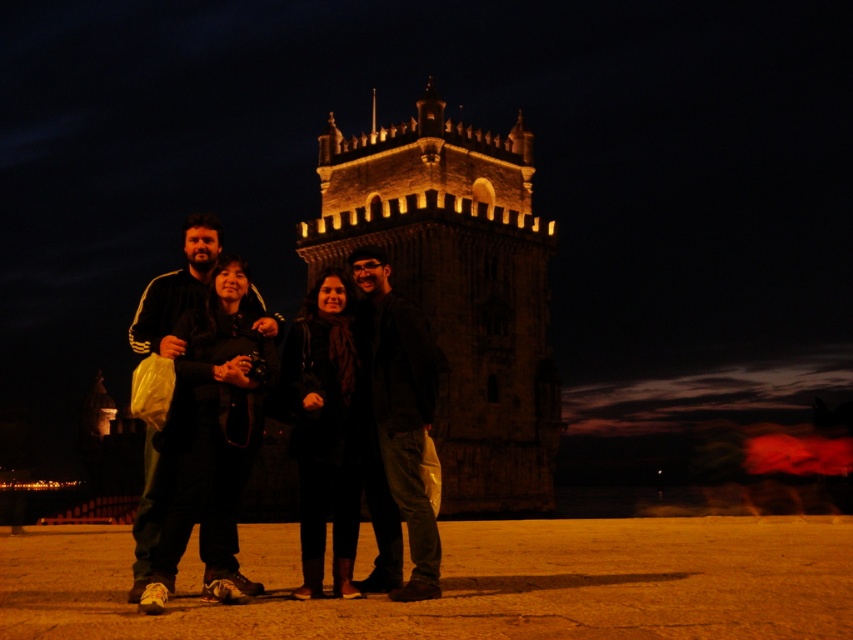
Question: Which of the following is the closest to the observer?

Choices:
 (A) (375, 369)
 (B) (167, 340)

Answer: (B)

Question: Is brick stone tower at center positioned behind black matte coat at center?

Choices:
 (A) no
 (B) yes

Answer: (B)

Question: Which point is farther to the camera?

Choices:
 (A) (338, 333)
 (B) (167, 330)
 (C) (387, 499)

Answer: (B)

Question: Can you confirm if brick stone tower at center is positioned to the right of black matte coat at center?

Choices:
 (A) no
 (B) yes

Answer: (B)

Question: Where is dark gray jacket at center located in relation to black matte coat at center in the image?

Choices:
 (A) left
 (B) right

Answer: (B)

Question: Among these points, which one is farthest from the camera?

Choices:
 (A) (390, 369)
 (B) (154, 524)
 (C) (431, 138)

Answer: (C)